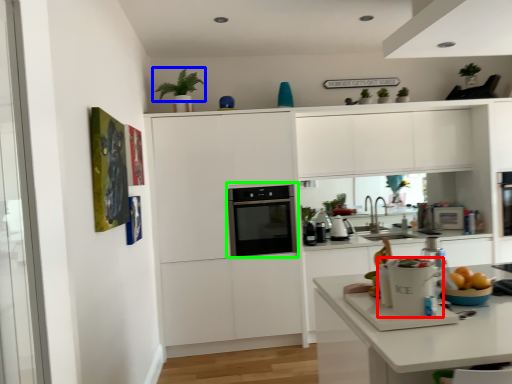
Question: Based on their relative distances, which object is farther from kitchen appliance (highlighted by a red box)? Choose from plant (highlighted by a blue box) and home appliance (highlighted by a green box).

Choices:
 (A) plant
 (B) home appliance

Answer: (A)